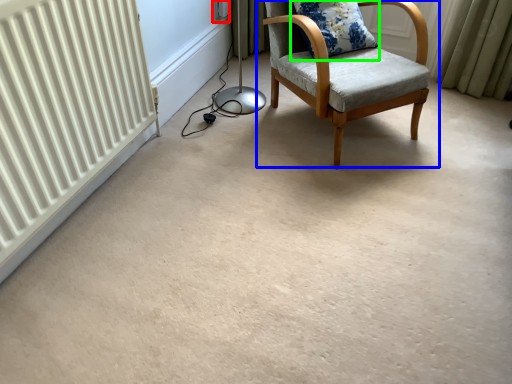
Question: Estimate the real-world distances between objects in this image. Which object is closer to electric outlet (highlighted by a red box), chair (highlighted by a blue box) or pillow (highlighted by a green box)?

Choices:
 (A) chair
 (B) pillow

Answer: (B)